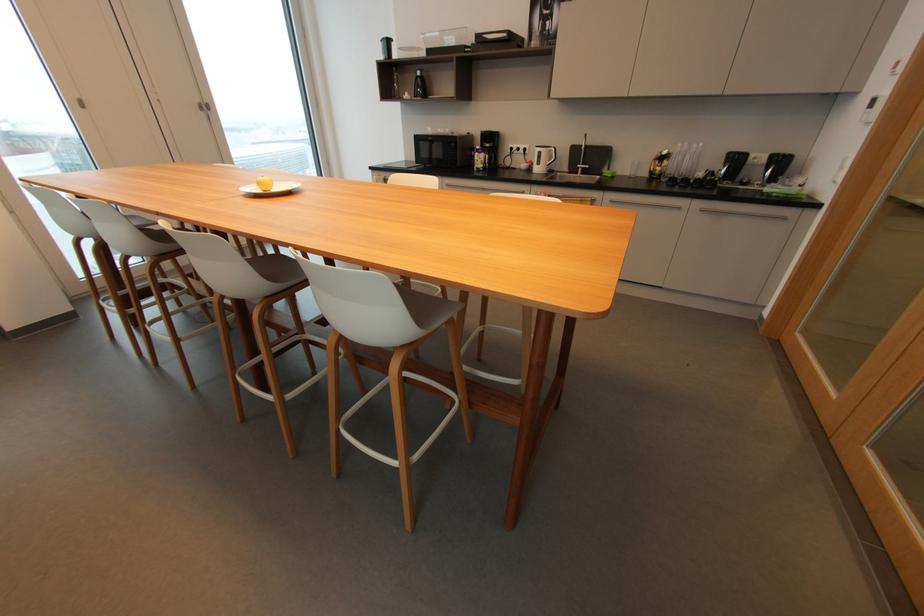
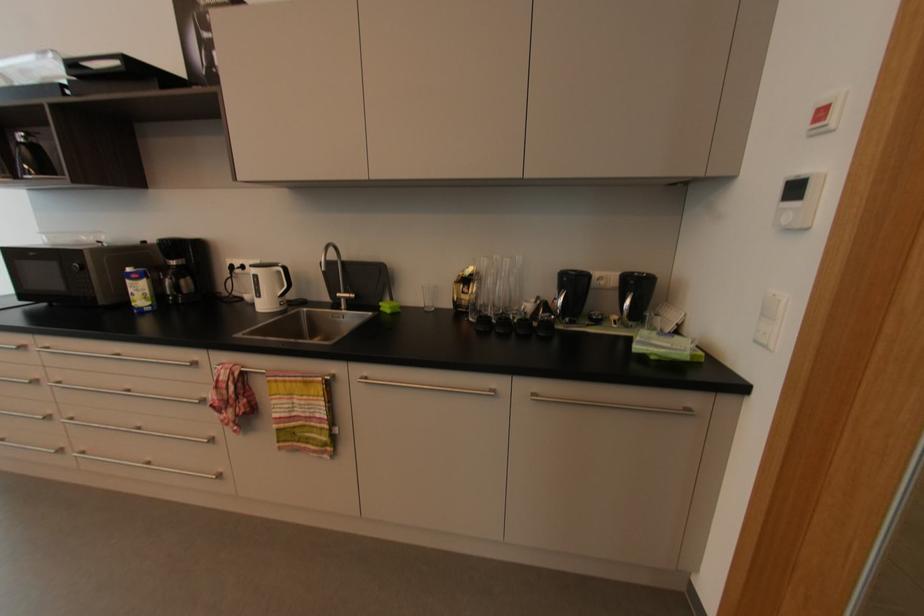
Find the pixel in the second image that matches point (723, 180) in the first image.

(561, 317)